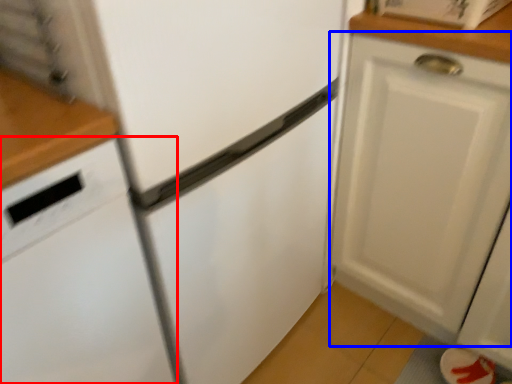
Question: Which object is further to the camera taking this photo, dish washer (highlighted by a red box) or cabinetry (highlighted by a blue box)?

Choices:
 (A) dish washer
 (B) cabinetry

Answer: (B)